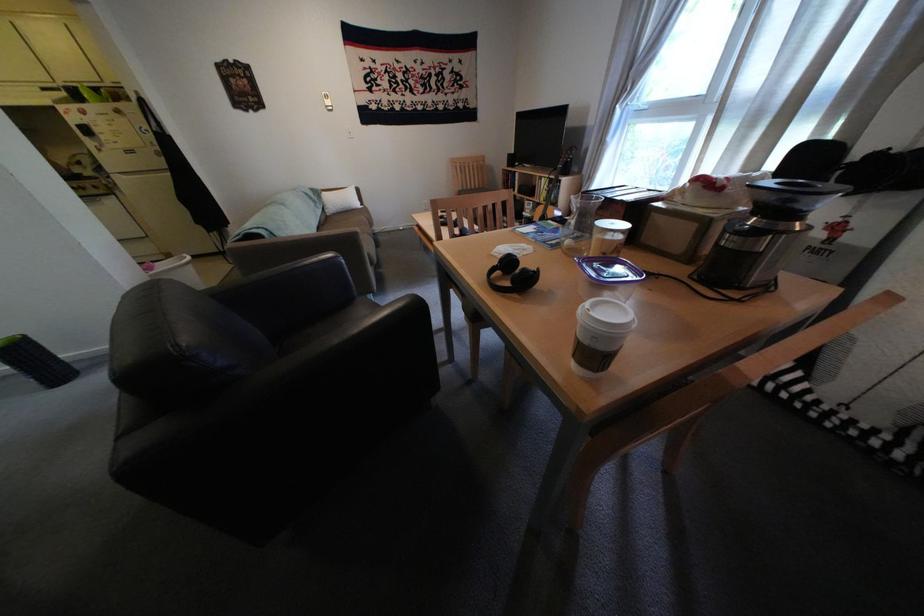
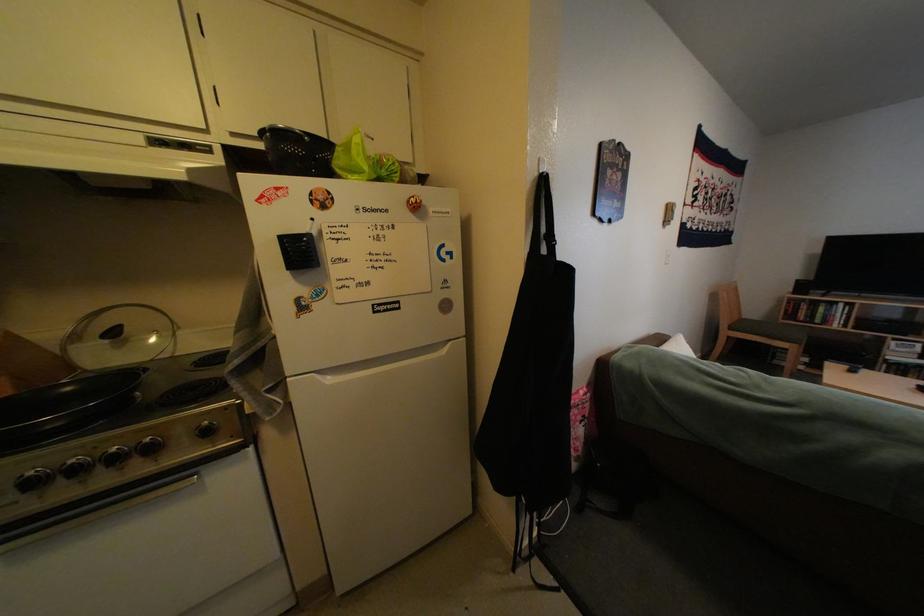
Which direction would the cameraman need to move to produce the second image?

The movement direction of the cameraman is left, forward.